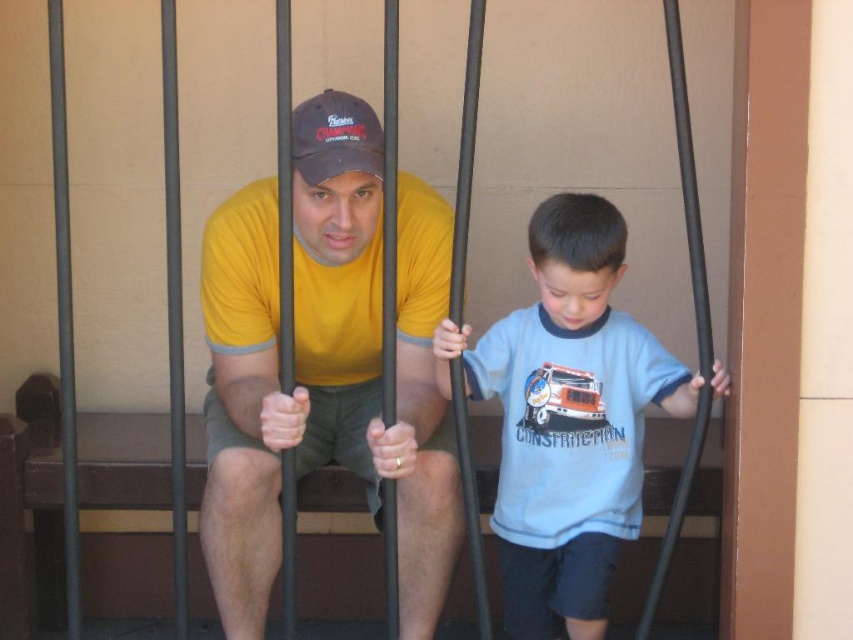
You are a tailor measuring for alterations. You need to determine if there is enough space between the light blue cotton shirt at center and the matte black baseball cap at center to insert a 50 cm long decorative ribbon. Can you fit it?

The light blue cotton shirt at center and matte black baseball cap at center are 55.61 centimeters apart. Since 55.61 cm is greater than 50 cm, the ribbon can fit between them.